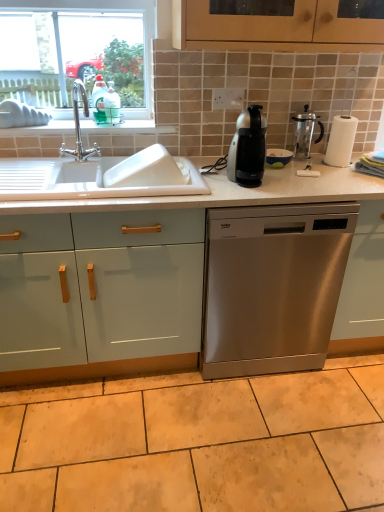
At what (x,y) coordinates should I click in order to perform the action: click on free space above stainless steel dishwasher at center (from a real-world perspective). Please return your answer as a coordinate pair (x, y). The image size is (384, 512). Looking at the image, I should click on (269, 177).